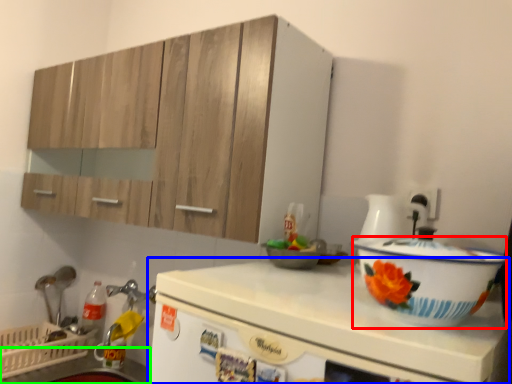
Question: Based on their relative distances, which object is nearer to basin (highlighted by a red box)? Choose from countertop (highlighted by a blue box) and counter top (highlighted by a green box).

Choices:
 (A) countertop
 (B) counter top

Answer: (A)